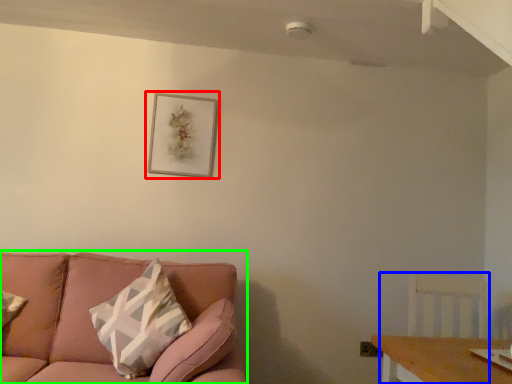
Question: Which object is the farthest from picture frame (highlighted by a red box)? Choose among these: swivel chair (highlighted by a blue box) or studio couch (highlighted by a green box).

Choices:
 (A) swivel chair
 (B) studio couch

Answer: (A)